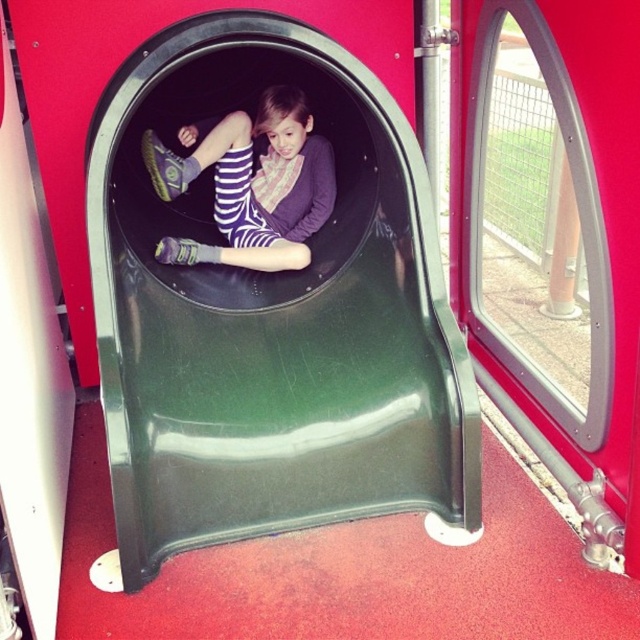
Question: Is green plastic slide at center further to the viewer compared to striped fabric pants at center?

Choices:
 (A) yes
 (B) no

Answer: (B)

Question: Which object appears closest to the camera in this image?

Choices:
 (A) striped fabric pants at center
 (B) green plastic slide at center

Answer: (B)

Question: Which of the following is the closest to the observer?

Choices:
 (A) striped fabric pants at center
 (B) green plastic slide at center

Answer: (B)

Question: Does green plastic slide at center appear over striped fabric pants at center?

Choices:
 (A) no
 (B) yes

Answer: (A)

Question: Can you confirm if green plastic slide at center is thinner than striped fabric pants at center?

Choices:
 (A) no
 (B) yes

Answer: (A)